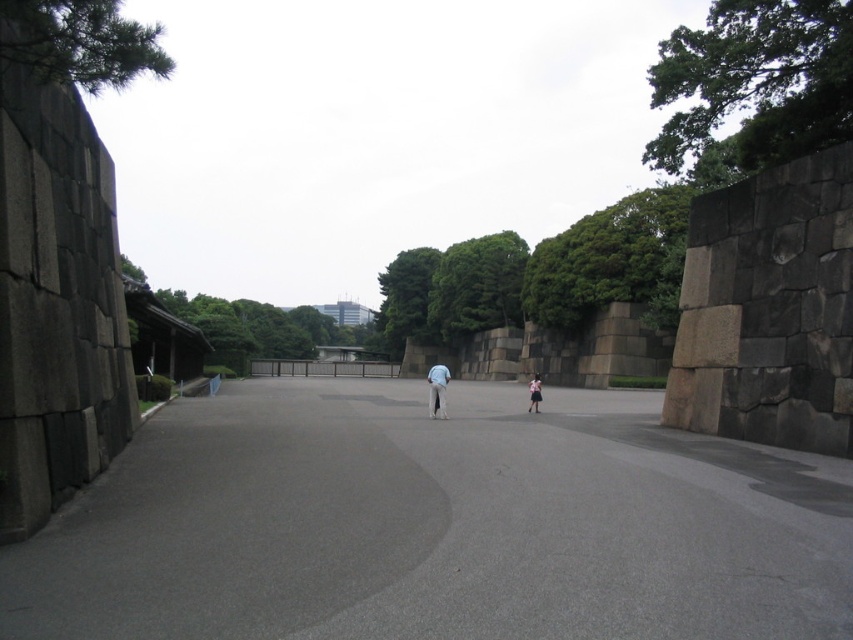
Question: Which is farther from the light blue fabric at center?

Choices:
 (A) dark gray stone wall at right
 (B) gray asphalt pavement at center
 (C) light blue fabric pants at center

Answer: (C)

Question: Can you confirm if dark gray stone wall at right is thinner than light blue fabric pants at center?

Choices:
 (A) yes
 (B) no

Answer: (A)

Question: Is dark gray stone wall at right to the right of light blue fabric pants at center from the viewer's perspective?

Choices:
 (A) yes
 (B) no

Answer: (A)

Question: Which of the following is the closest to the observer?

Choices:
 (A) light blue fabric at center
 (B) gray asphalt pavement at center

Answer: (B)

Question: Can you confirm if gray asphalt pavement at center is positioned below light blue fabric at center?

Choices:
 (A) no
 (B) yes

Answer: (A)

Question: Which object is farther from the camera taking this photo?

Choices:
 (A) light blue fabric at center
 (B) gray asphalt pavement at center
 (C) light blue fabric pants at center

Answer: (A)